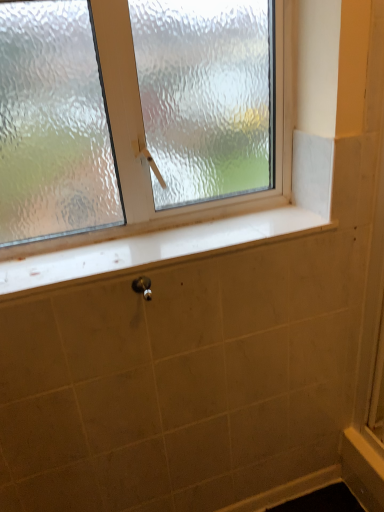
Question: Is metallic silver shower at lower center aimed at frosted glass window at upper center?

Choices:
 (A) no
 (B) yes

Answer: (A)

Question: Considering the relative positions of metallic silver shower at lower center and frosted glass window at upper center in the image provided, is metallic silver shower at lower center behind frosted glass window at upper center?

Choices:
 (A) no
 (B) yes

Answer: (B)

Question: From the image's perspective, is metallic silver shower at lower center on top of frosted glass window at upper center?

Choices:
 (A) no
 (B) yes

Answer: (A)

Question: Would you say frosted glass window at upper center is part of metallic silver shower at lower center's contents?

Choices:
 (A) yes
 (B) no

Answer: (B)

Question: Can you confirm if metallic silver shower at lower center is smaller than frosted glass window at upper center?

Choices:
 (A) yes
 (B) no

Answer: (A)

Question: Is metallic silver shower at lower center not within frosted glass window at upper center?

Choices:
 (A) no
 (B) yes

Answer: (B)

Question: From the image's perspective, is white glossy window sill at center located beneath frosted glass window at upper center?

Choices:
 (A) yes
 (B) no

Answer: (A)

Question: Is white glossy window sill at center placed right next to frosted glass window at upper center?

Choices:
 (A) yes
 (B) no

Answer: (B)

Question: Is white glossy window sill at center surrounding frosted glass window at upper center?

Choices:
 (A) no
 (B) yes

Answer: (A)

Question: Can you confirm if white glossy window sill at center is smaller than frosted glass window at upper center?

Choices:
 (A) yes
 (B) no

Answer: (A)

Question: Is white glossy window sill at center not near frosted glass window at upper center?

Choices:
 (A) no
 (B) yes

Answer: (A)

Question: Is white glossy window sill at center facing towards frosted glass window at upper center?

Choices:
 (A) yes
 (B) no

Answer: (B)

Question: From the image's perspective, does metallic silver shower at lower center appear higher than white glossy window sill at center?

Choices:
 (A) no
 (B) yes

Answer: (A)